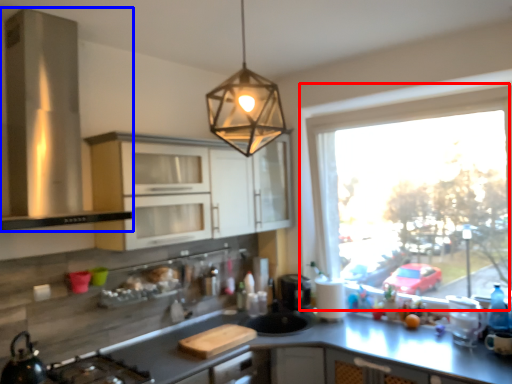
Question: Which point is closer to the camera, window (highlighted by a red box) or kitchen appliance (highlighted by a blue box)?

Choices:
 (A) window
 (B) kitchen appliance

Answer: (B)